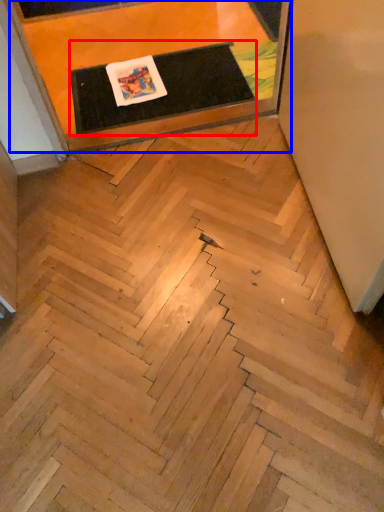
Question: Which of the following is the farthest to the observer, table (highlighted by a red box) or furniture (highlighted by a blue box)?

Choices:
 (A) table
 (B) furniture

Answer: (A)